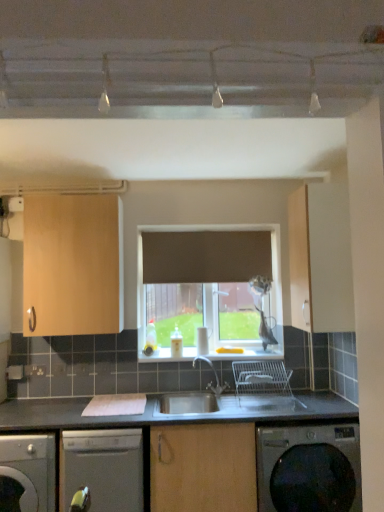
Question: Visually, is matte wood cabinet at right, placed as the first cabinetry when sorted from right to left, positioned to the left or to the right of satin silver dishwasher at lower left, the second dishwasher in the right-to-left sequence?

Choices:
 (A) left
 (B) right

Answer: (B)

Question: From a real-world perspective, is matte wood cabinet at right, placed as the first cabinetry when sorted from right to left, physically located above or below satin silver dishwasher at lower left, acting as the first dishwasher starting from the left?

Choices:
 (A) below
 (B) above

Answer: (B)

Question: Which object is positioned farthest from the white glossy window sill at center?

Choices:
 (A) satin silver dishwasher at lower left, acting as the first dishwasher starting from the left
 (B) light wood cabinet at upper left, the first cabinetry viewed from the left
 (C) satin silver dishwasher at lower center, acting as the second dishwasher starting from the left
 (D) satin silver sink at center
 (E) dark gray metallic washing machine at lower right

Answer: (A)

Question: Which object is positioned closest to the satin silver sink at center?

Choices:
 (A) satin silver dishwasher at lower center, the 1th dishwasher viewed from the right
 (B) light wood cabinet at upper left, which ranks as the 2th cabinetry in right-to-left order
 (C) white glossy window sill at center
 (D) satin silver dishwasher at lower left, the second dishwasher in the right-to-left sequence
 (E) matte wood cabinet at right, the second cabinetry when ordered from left to right

Answer: (C)